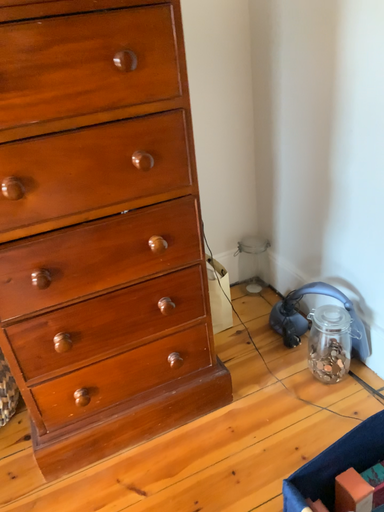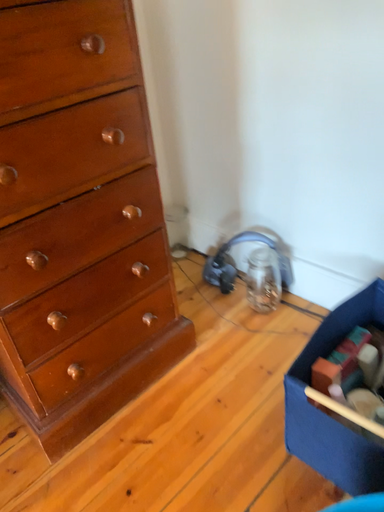
Question: How did the camera likely rotate when shooting the video?

Choices:
 (A) rotated right
 (B) rotated left

Answer: (A)